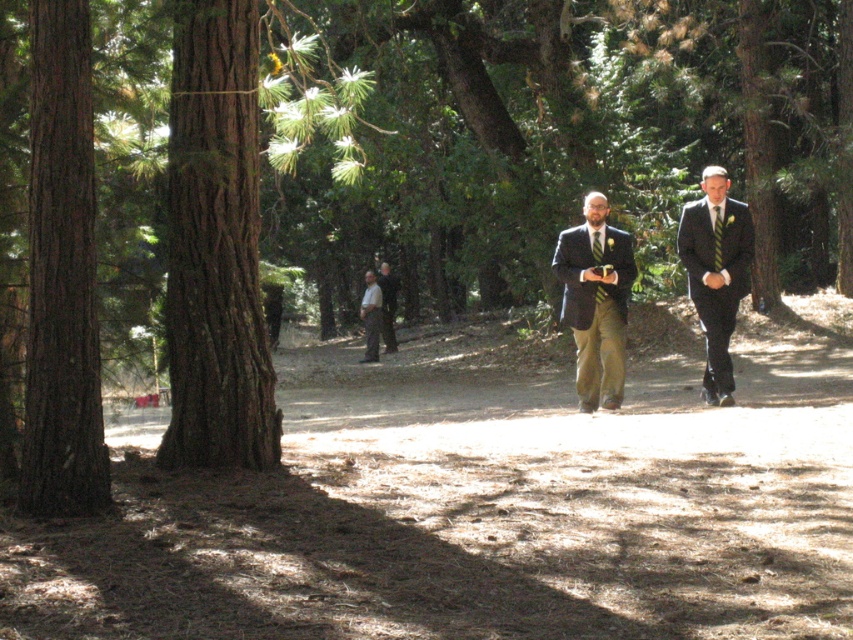
You are a photographer trying to capture both the smooth brown bark at left and the light brown leather jacket at center in a single frame. Since you want to focus on the larger subject, which object should you prioritize in your composition?

The light brown leather jacket at center should be prioritized in the composition because it occupies more space than the smooth brown bark at left.

You are a photographer trying to capture both the brown rough bark tree at left and the matte black suit at center in the same frame. Based on their sizes, which object should you focus on first to ensure both are in the frame?

The brown rough bark tree at left is smaller than the matte black suit at center, so you should focus on the matte black suit at center first to ensure both are in the frame since it is larger and requires more space.